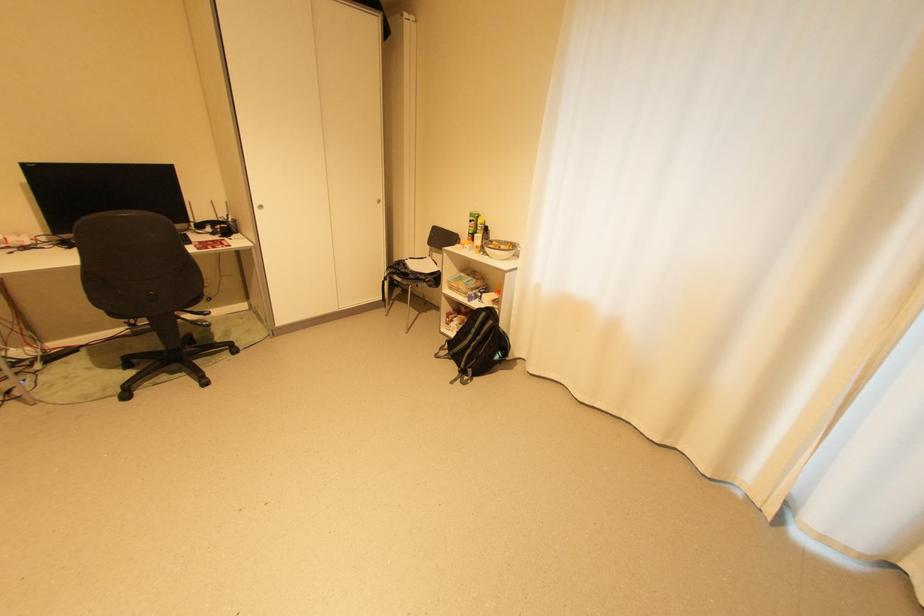
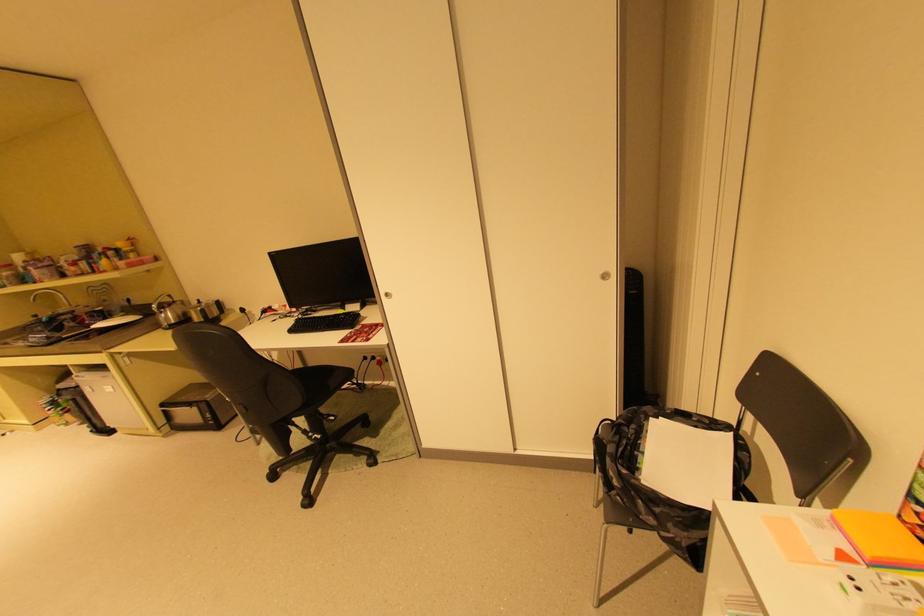
Where in the second image is the point corresponding to [408,264] from the first image?

(640, 427)